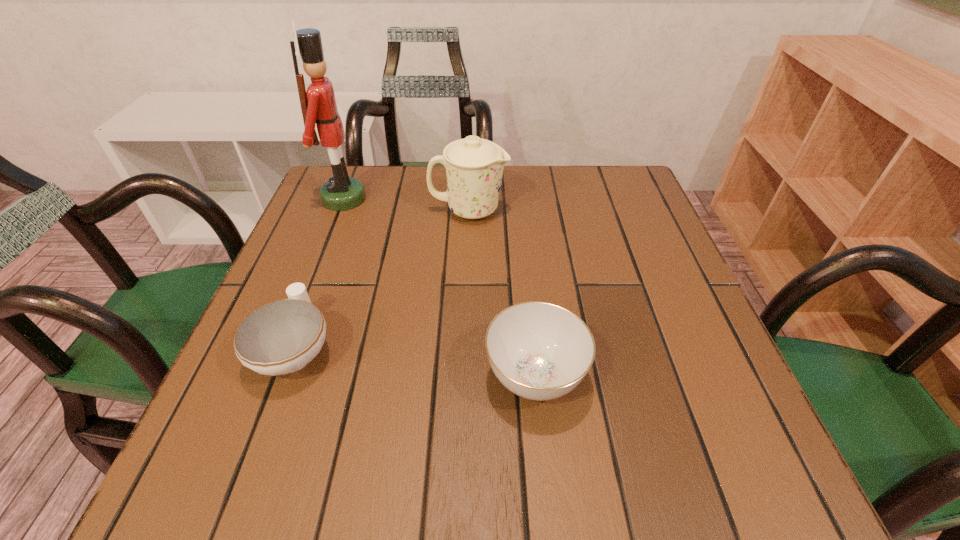
What are the coordinates of `the tallest object` in the screenshot? It's located at point(318,105).

The image size is (960, 540). In order to click on the farthest chinaware in this screenshot , I will do `click(474, 166)`.

You are a GUI agent. You are given a task and a screenshot of the screen. Output one action in this format:
    pyautogui.click(x=<x>, y=<y>)
    Task: Click on the tallest chinaware
    The image size is (960, 540).
    Given the screenshot: What is the action you would take?
    pyautogui.click(x=474, y=166)

The height and width of the screenshot is (540, 960). I want to click on the second shortest object, so click(540, 351).

The height and width of the screenshot is (540, 960). What are the coordinates of `the shortest object` in the screenshot? It's located at (281, 337).

You are a GUI agent. You are given a task and a screenshot of the screen. Output one action in this format:
    pyautogui.click(x=<x>, y=<y>)
    Task: Click on the leftmost chinaware
    
    Given the screenshot: What is the action you would take?
    pyautogui.click(x=281, y=337)

At what (x,y) coordinates should I click in order to perform the action: click on vacant space located 0.070m on the front-facing side of the tallest object. Please return your answer as a coordinate pair (x, y). This screenshot has width=960, height=540. Looking at the image, I should click on (394, 199).

The width and height of the screenshot is (960, 540). I want to click on free location located on the spout of the third shortest object, so tap(617, 210).

You are a GUI agent. You are given a task and a screenshot of the screen. Output one action in this format:
    pyautogui.click(x=<x>, y=<y>)
    Task: Click on the blank space located 0.150m on the left of the second shortest object
    This screenshot has height=540, width=960.
    Given the screenshot: What is the action you would take?
    pyautogui.click(x=394, y=376)

In order to click on vacant space located 0.110m on the side with the handle of the leftmost chinaware in this screenshot , I will do `click(324, 271)`.